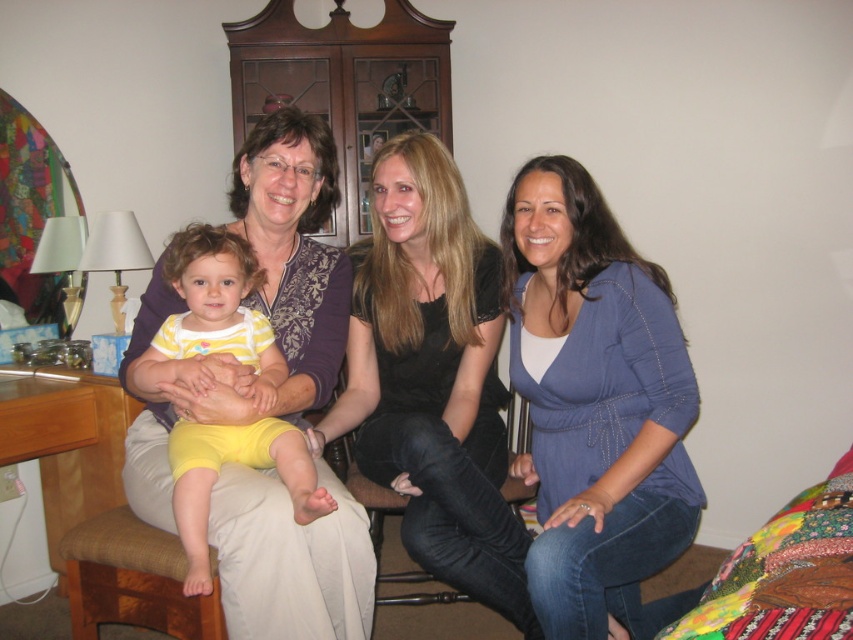
Who is more forward, (486, 509) or (270, 403)?

Point (270, 403) is more forward.

What do you see at coordinates (432, 378) in the screenshot? I see `black matte shirt at center` at bounding box center [432, 378].

The height and width of the screenshot is (640, 853). I want to click on black matte shirt at center, so click(432, 378).

Is matte blue blouse at center positioned before black matte shirt at center?

Yes, matte blue blouse at center is in front of black matte shirt at center.

Who is lower down, matte blue blouse at center or black matte shirt at center?

matte blue blouse at center is lower down.

Identify the location of matte blue blouse at center. (596, 406).

Which is behind, point (445, 173) or point (619, 556)?

The point (445, 173) is more distant.

Which is below, matte black shirt at center or matte blue blouse at center?

Positioned lower is matte black shirt at center.

What are the coordinates of `matte black shirt at center` in the screenshot? It's located at tap(404, 352).

The image size is (853, 640). Find the location of `matte black shirt at center`. matte black shirt at center is located at coordinates (404, 352).